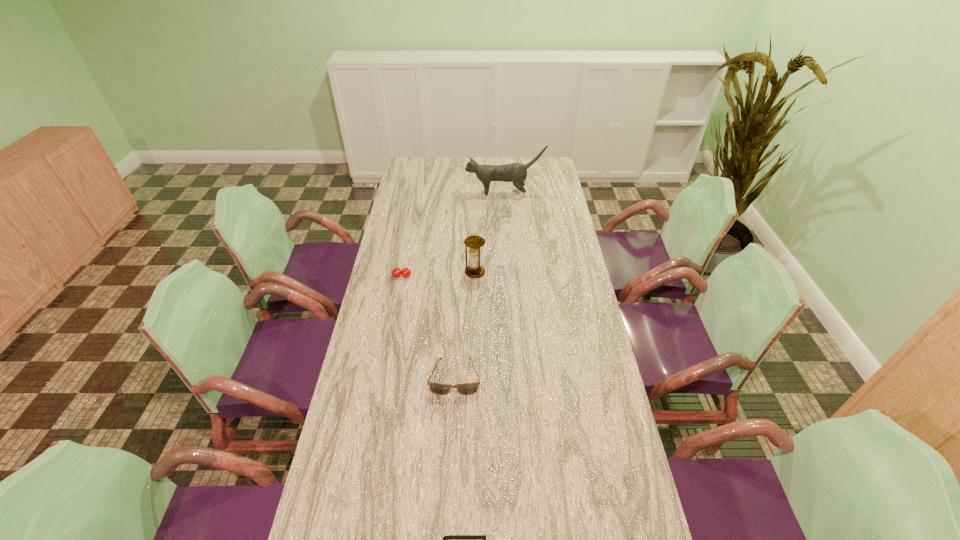
Identify the location of cat. This screenshot has height=540, width=960. pos(516,173).

Where is `the tallest object`? The width and height of the screenshot is (960, 540). the tallest object is located at coordinates (516, 173).

This screenshot has height=540, width=960. What are the coordinates of `hourglass` in the screenshot? It's located at (474, 270).

I want to click on the third shortest object, so click(396, 272).

The width and height of the screenshot is (960, 540). I want to click on cherry, so click(396, 272).

Where is `the taller sunglasses`? The width and height of the screenshot is (960, 540). the taller sunglasses is located at coordinates point(437,388).

At what (x,y) coordinates should I click in order to perform the action: click on the farther sunglasses. Please return your answer as a coordinate pair (x, y). Looking at the image, I should click on (437, 388).

Locate an element on the screen. vacant space located at the face of the tallest object is located at coordinates (437, 194).

Identify the location of free spot located at the face of the tallest object. Image resolution: width=960 pixels, height=540 pixels. tap(422, 194).

At what (x,y) coordinates should I click in order to perform the action: click on vacant region located 0.090m at the face of the tallest object. Please return your answer as a coordinate pair (x, y). The height and width of the screenshot is (540, 960). Looking at the image, I should click on (446, 194).